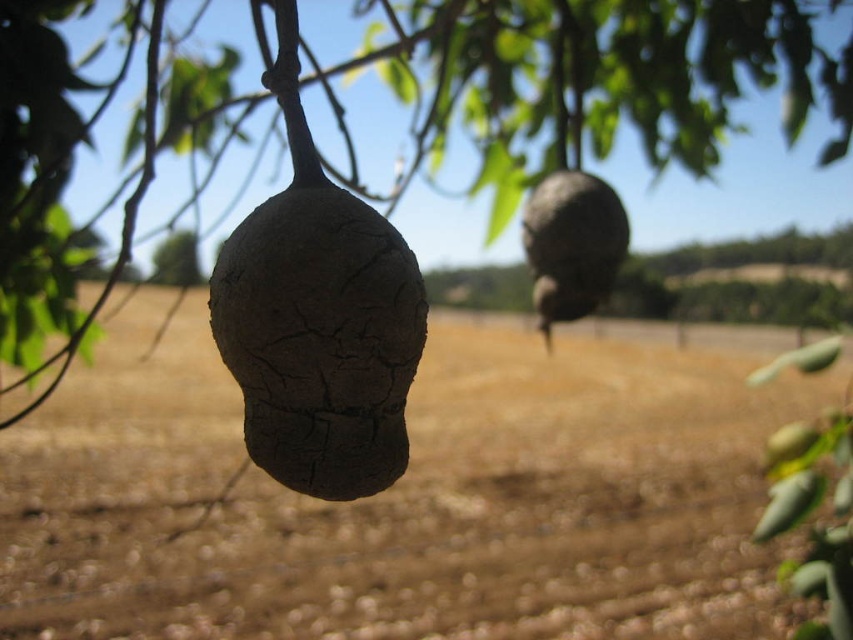
You are a gardener who wants to plant a new seed in the brown soil at center. However, there is a rough bark fruit at center above it. Do you think the seed will be able to grow properly here?

The brown soil at center is positioned under the rough bark fruit at center, which may block sunlight and drop debris onto the soil. This could hinder the seed from growing properly due to lack of sunlight and added obstacles.

You are an orchard worker checking the health of fruits on a tree. You notice two fruits at the center of the image. Which fruit is taller, the cracked brown fruit at center or the rough bark fruit at center?

The cracked brown fruit at center is taller than the rough bark fruit at center.

You are standing in front of the tree and want to pick the cracked brown fruit at center. Based on its position coordinates, can you estimate whether it is closer to the top or bottom of the tree?

The cracked brown fruit at center is located at point coordinates 0.531 on the x and 0.376 on the y. Since the coordinate system typically places 0 at the bottom and 1 at the top, the y value of 0.376 indicates it is closer to the bottom of the tree.